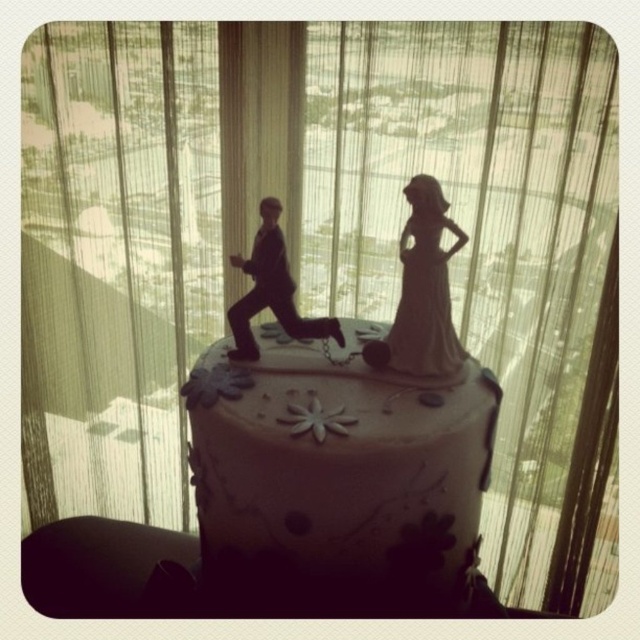
Who is higher up, matte white figurine at center or matte black figure at center?

matte black figure at center is higher up.

Describe the element at coordinates (422, 291) in the screenshot. I see `matte white figurine at center` at that location.

Where is `matte white figurine at center`? This screenshot has height=640, width=640. matte white figurine at center is located at coordinates (422, 291).

Can you confirm if matte white figurine at center is positioned to the left of white porcelain bride at center?

Correct, you'll find matte white figurine at center to the left of white porcelain bride at center.

Does point (424, 221) come farther from viewer compared to point (420, 269)?

No, (424, 221) is closer to viewer.

The image size is (640, 640). I want to click on matte white figurine at center, so click(422, 291).

Is white matte cake at center bigger than matte white figurine at center?

Yes, white matte cake at center is bigger than matte white figurine at center.

Locate an element on the screen. This screenshot has height=640, width=640. white matte cake at center is located at coordinates (339, 474).

Does point (284, 442) come closer to viewer compared to point (422, 230)?

That is True.

Image resolution: width=640 pixels, height=640 pixels. Find the location of `white matte cake at center`. white matte cake at center is located at coordinates (339, 474).